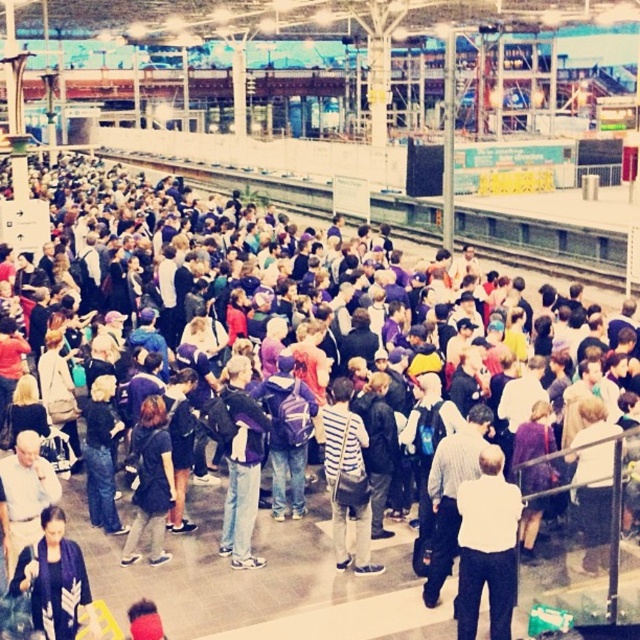
You are a photographer standing in the train station. You want to take a photo of the crowd that includes both the white matte shirt at center and the dark blue textured jacket at lower left. However, you notice that one of the subjects is significantly taller than the other. Which subject would you need to adjust your camera angle to capture fully in the frame?

The white matte shirt at center is much taller than the dark blue textured jacket at lower left. To capture the taller subject fully, you would need to angle the camera upward to include the entire height of the white matte shirt at center while still framing the shorter dark blue textured jacket at lower left.

You are a photographer standing in the train station and you want to take a photo of both the white matte shirt at center and the striped fabric shirt at center. Which one will be partially hidden if you frame the shot to include both?

The striped fabric shirt at center will be partially hidden because the white matte shirt at center is much taller and may block part of it.

You are a photographer at the train station. You see the dark blue textured jacket at lower left and your camera. How far apart are they?

The dark blue textured jacket at lower left and camera are 22.75 meters apart.